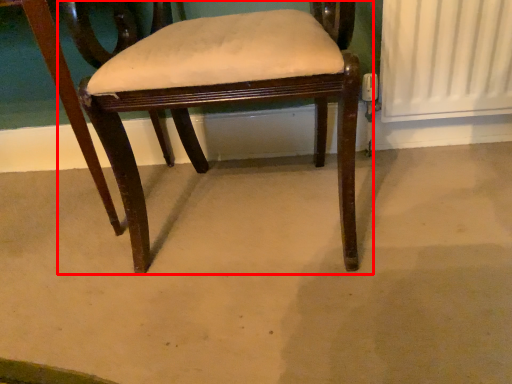
Question: From the image's perspective, where is chair (annotated by the red box) located in relation to concrete in the image?

Choices:
 (A) below
 (B) above

Answer: (B)